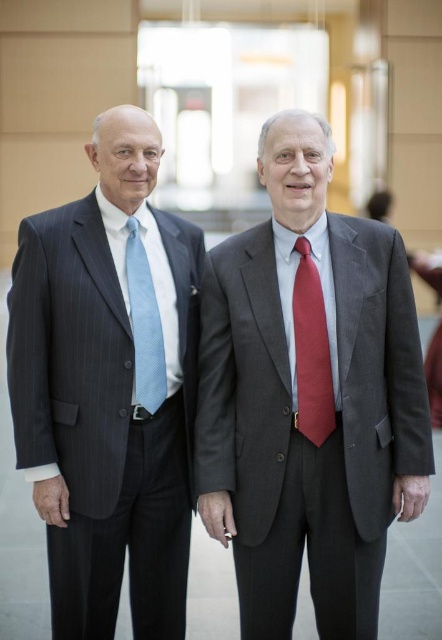
Is pinstriped suit at left shorter than matte red tie at center?

No.

Is pinstriped suit at left closer to camera compared to matte red tie at center?

No, it is not.

Is point (69, 532) farther from viewer compared to point (320, 365)?

Yes, point (69, 532) is farther from viewer.

Identify the location of pinstriped suit at left. This screenshot has width=442, height=640. (109, 387).

Is gray pinstripe suit at center positioned before matte red tie at center?

Yes, it is in front of matte red tie at center.

Who is more forward, (x=406, y=337) or (x=312, y=264)?

Positioned in front is point (x=312, y=264).

The image size is (442, 640). Identify the location of gray pinstripe suit at center. (301, 433).

Does point (57, 365) come behind point (144, 320)?

That is False.

Based on the photo, is pinstriped suit at left above light blue textured tie at left?

Actually, pinstriped suit at left is below light blue textured tie at left.

Is point (34, 237) behind point (151, 280)?

No, it is not.

The height and width of the screenshot is (640, 442). In order to click on pinstriped suit at left in this screenshot , I will do [x=109, y=387].